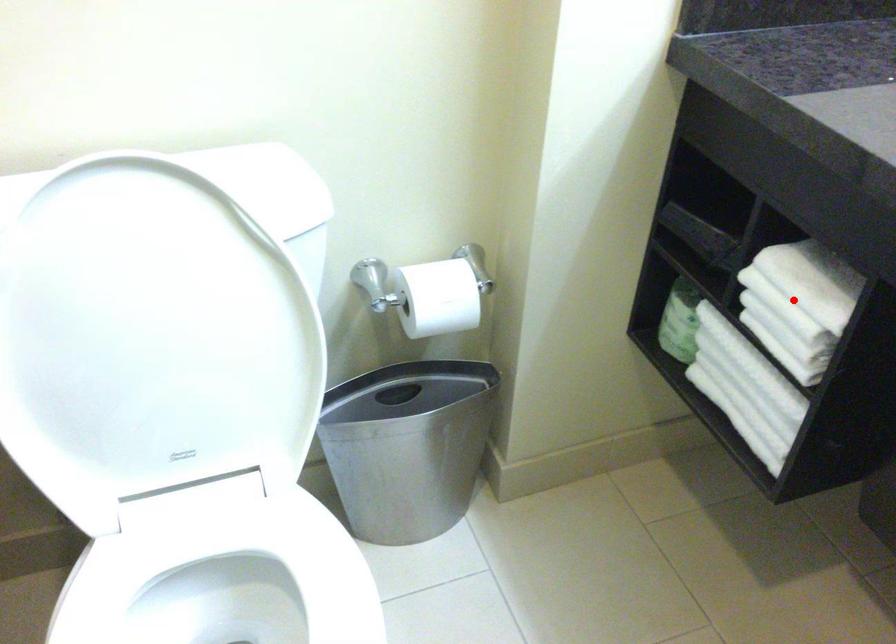
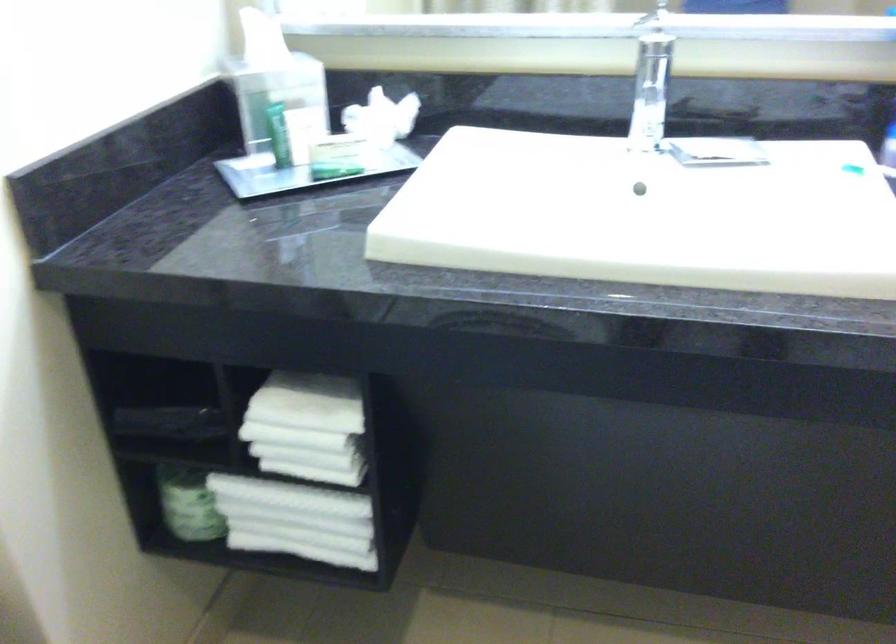
Find the pixel in the second image that matches the highlighted location in the first image.

(307, 428)